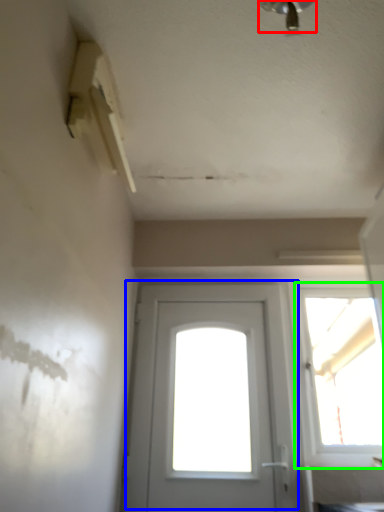
Question: Which is farther away from light fixture (highlighted by a red box)? door (highlighted by a blue box) or window (highlighted by a green box)?

Choices:
 (A) door
 (B) window

Answer: (A)